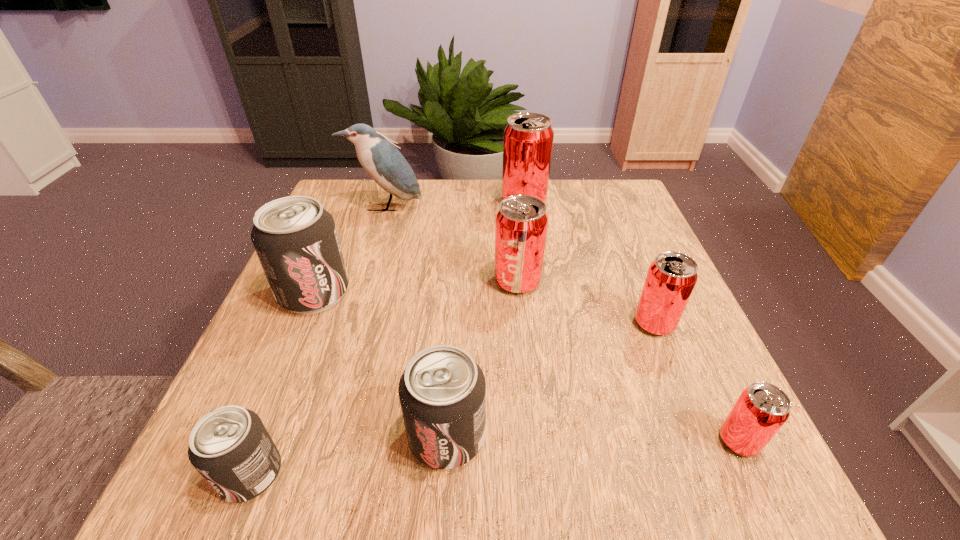
The width and height of the screenshot is (960, 540). What are the coordinates of `free location located on the front of the farthest soda can` in the screenshot? It's located at (538, 302).

Identify the location of vacant space situated at the tip of the blue bird's beak. This screenshot has width=960, height=540. (374, 241).

The image size is (960, 540). Find the location of `free space located on the right of the second farthest red soda can`. free space located on the right of the second farthest red soda can is located at coordinates (x=569, y=282).

Locate an element on the screen. This screenshot has width=960, height=540. free space located 0.290m on the right of the biggest black soda can is located at coordinates pos(490,293).

Image resolution: width=960 pixels, height=540 pixels. What are the coordinates of `vacant space situated on the left of the second smallest red soda can` in the screenshot? It's located at (493, 323).

At what (x,y) coordinates should I click in order to perform the action: click on vacant space located 0.240m on the right of the fifth soda can from right to left. Please return your answer as a coordinate pair (x, y). This screenshot has height=540, width=960. Looking at the image, I should click on (642, 436).

Identify the location of vacant space located on the left of the nearest red soda can. The image size is (960, 540). (620, 441).

Image resolution: width=960 pixels, height=540 pixels. Find the location of `vacant position located 0.250m on the right of the smallest black soda can`. vacant position located 0.250m on the right of the smallest black soda can is located at coordinates (457, 474).

At what (x,y) coordinates should I click in order to perform the action: click on soda can present at the far edge. Please return your answer as a coordinate pair (x, y). Looking at the image, I should click on (528, 137).

Find the location of `bird that is at the far edge`. bird that is at the far edge is located at coordinates (383, 162).